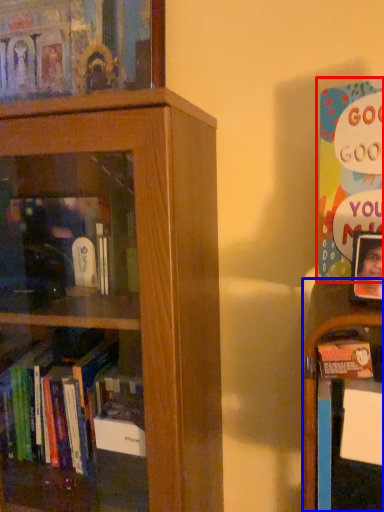
Question: Among these objects, which one is farthest to the camera, book (highlighted by a red box) or shelf (highlighted by a blue box)?

Choices:
 (A) book
 (B) shelf

Answer: (B)